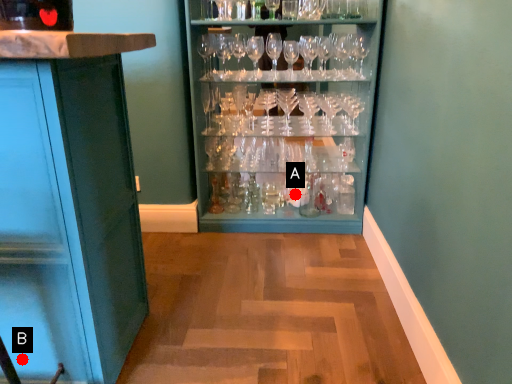
Question: Two points are circled on the image, labeled by A and B beside each circle. Which point appears closest to the camera in this image?

Choices:
 (A) A is closer
 (B) B is closer

Answer: (B)